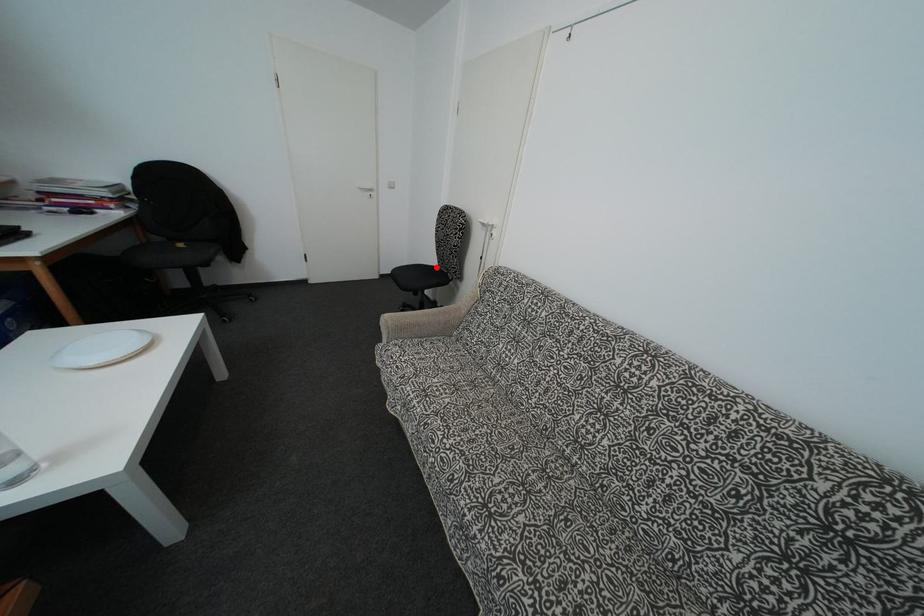
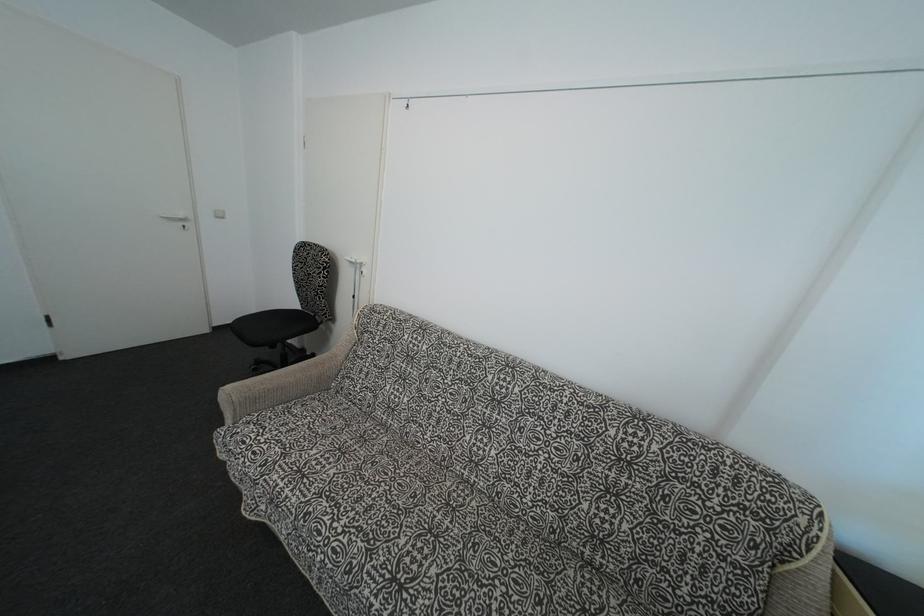
Question: I am providing you with two images of the same scene from different viewpoints. In image1, a red point is highlighted. Considering the same 3D point in image2, which of the following is correct?

Choices:
 (A) It is closer
 (B) It is farther

Answer: (B)